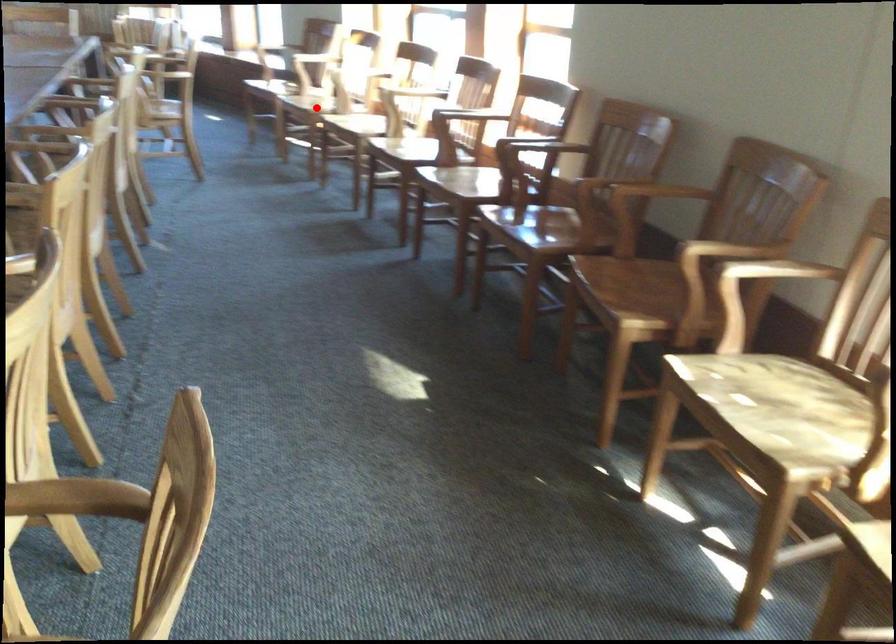
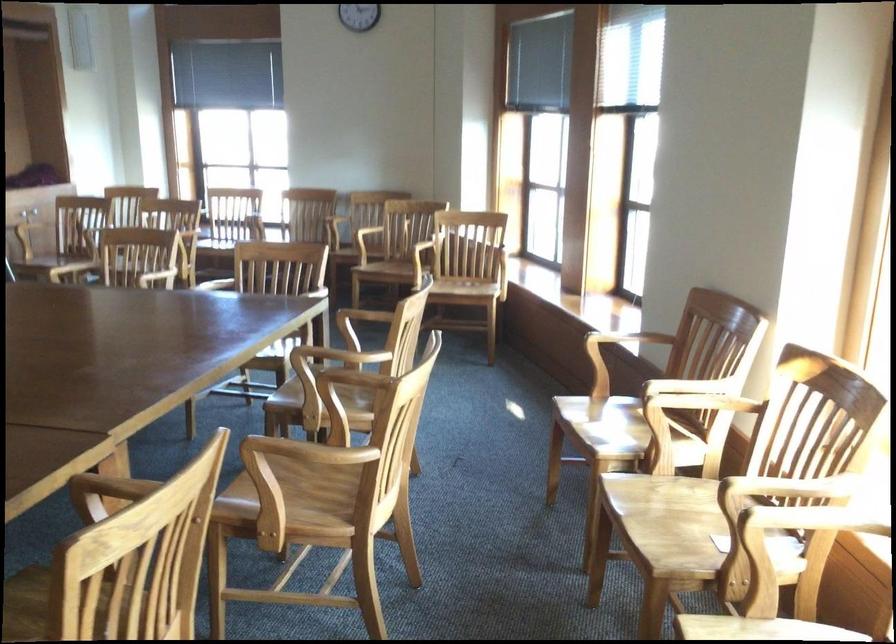
Locate, in the second image, the point that corresponds to the highlighted location in the first image.

(665, 526)